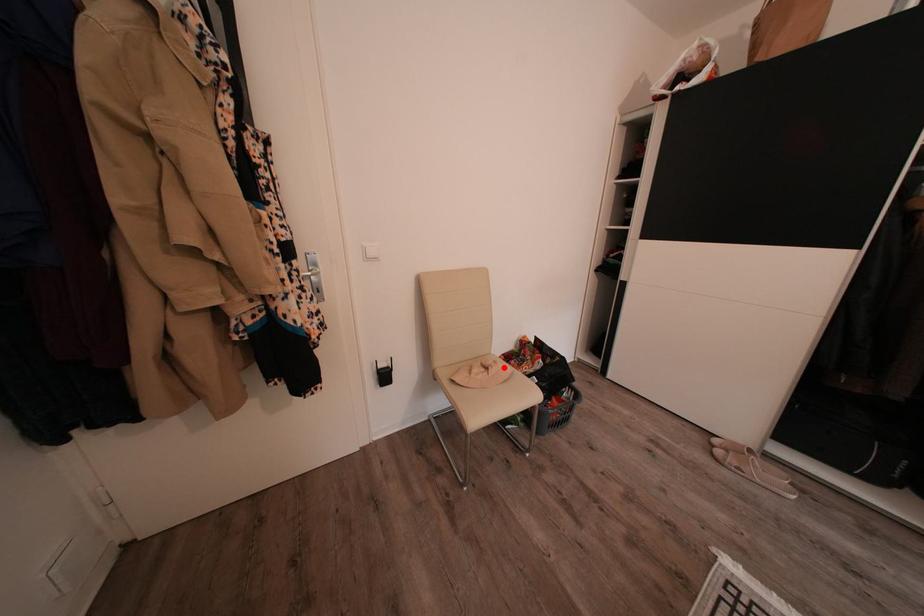
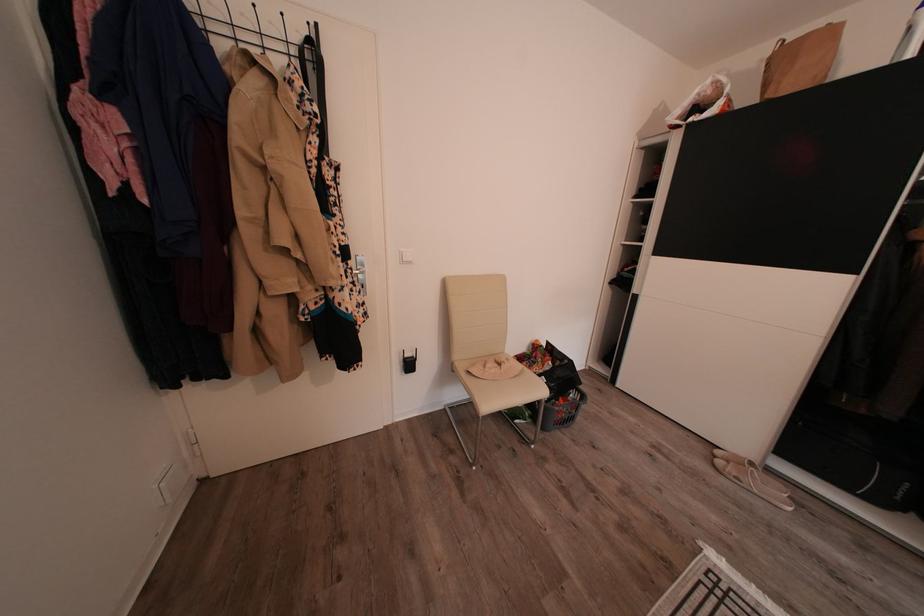
The point at the highlighted location is marked in the first image. Where is the corresponding point in the second image?

(516, 365)